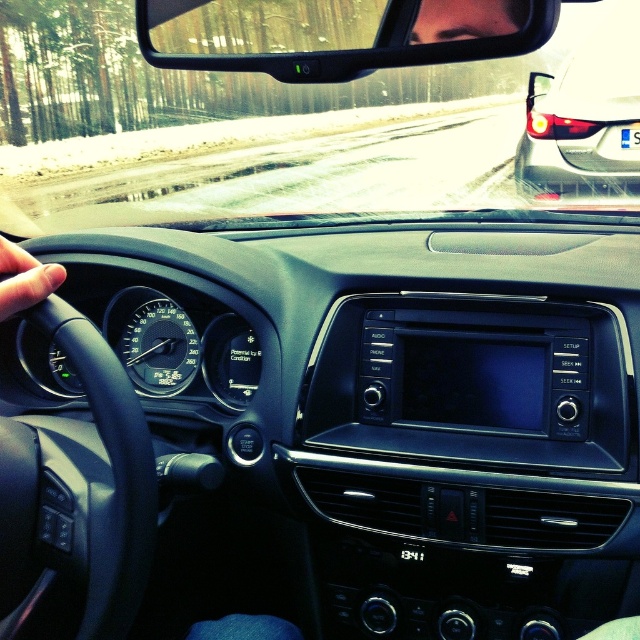
Is clear plastic view mirror at upper center closer to the viewer compared to black rubber steering wheel at left?

Yes.

Does clear plastic view mirror at upper center have a smaller size compared to black rubber steering wheel at left?

Incorrect, clear plastic view mirror at upper center is not smaller in size than black rubber steering wheel at left.

Locate an element on the screen. The width and height of the screenshot is (640, 640). clear plastic view mirror at upper center is located at coordinates (337, 33).

From the picture: Does transparent glass windshield at center have a greater width compared to clear plastic view mirror at upper center?

Correct, the width of transparent glass windshield at center exceeds that of clear plastic view mirror at upper center.

Between transparent glass windshield at center and clear plastic view mirror at upper center, which one has less height?

Standing shorter between the two is clear plastic view mirror at upper center.

The width and height of the screenshot is (640, 640). What are the coordinates of `transparent glass windshield at center` in the screenshot? It's located at (314, 112).

Does transparent glass windshield at center have a greater width compared to black rubber steering wheel at left?

Yes, transparent glass windshield at center is wider than black rubber steering wheel at left.

Can you confirm if transparent glass windshield at center is smaller than black rubber steering wheel at left?

No, transparent glass windshield at center is not smaller than black rubber steering wheel at left.

Is point (60, 132) closer to viewer compared to point (129, 401)?

No, it is behind (129, 401).

I want to click on transparent glass windshield at center, so click(x=314, y=112).